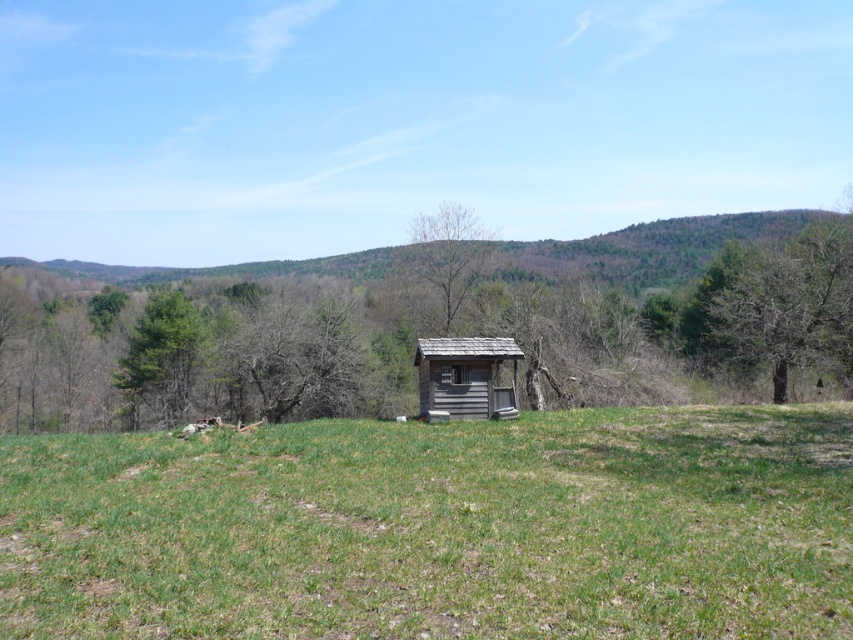
You are standing in the field looking towards the forest. Which tree is nearer to you, the green leafy tree at right or the bare wood tree at center?

The green leafy tree at right is closer to the viewer than the bare wood tree at center.

You are a gardener planning to plant some flowers in the green grassy field at center. You need to ensure that the flowers won not block the view of the weathered wood hut at center from the road. Based on the scene description, will the flowers, if planted, be shorter than the hut?

The green grassy field at center is not as tall as weathered wood hut at center. Since the flowers would be planted in the green grassy field at center, they would naturally be shorter than the hut, so they won not block the view.